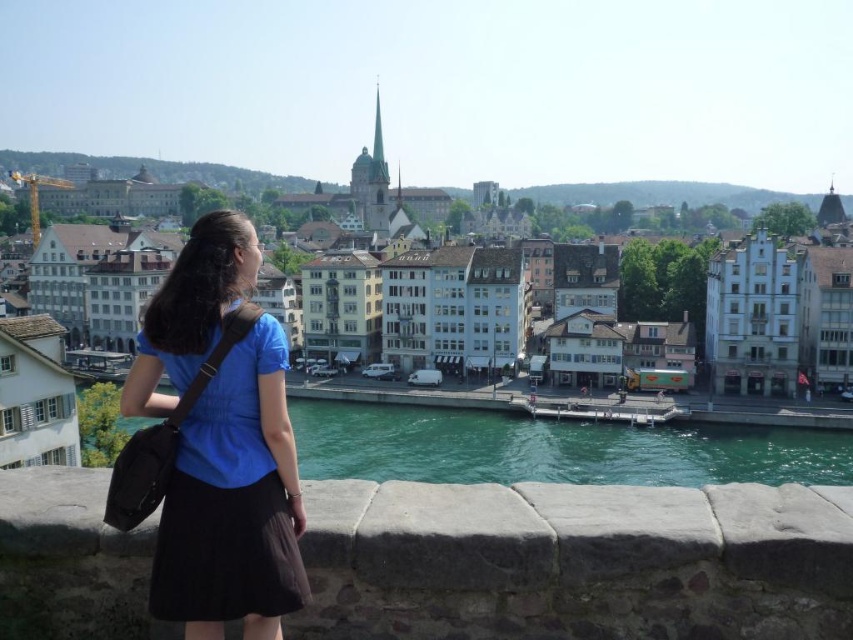
You are standing on a bridge overlooking a river. You see a blue fabric shirt at center and white stone buildings at center. Which object is closer to you?

The blue fabric shirt at center is closer to you because it is positioned below the white stone buildings at center, indicating it is in a lower elevation relative to the viewer.